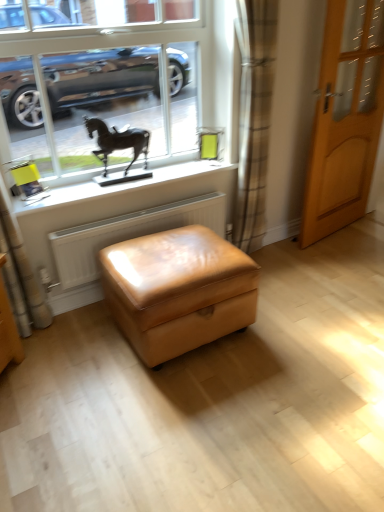
Locate an element on the screen. The image size is (384, 512). vacant area that lies to the right of leather ottoman at center is located at coordinates (302, 326).